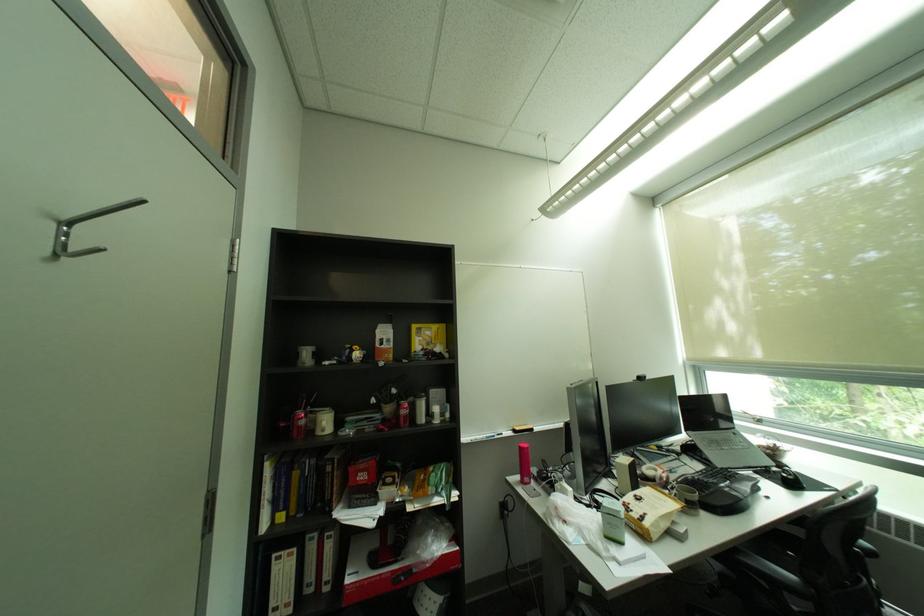
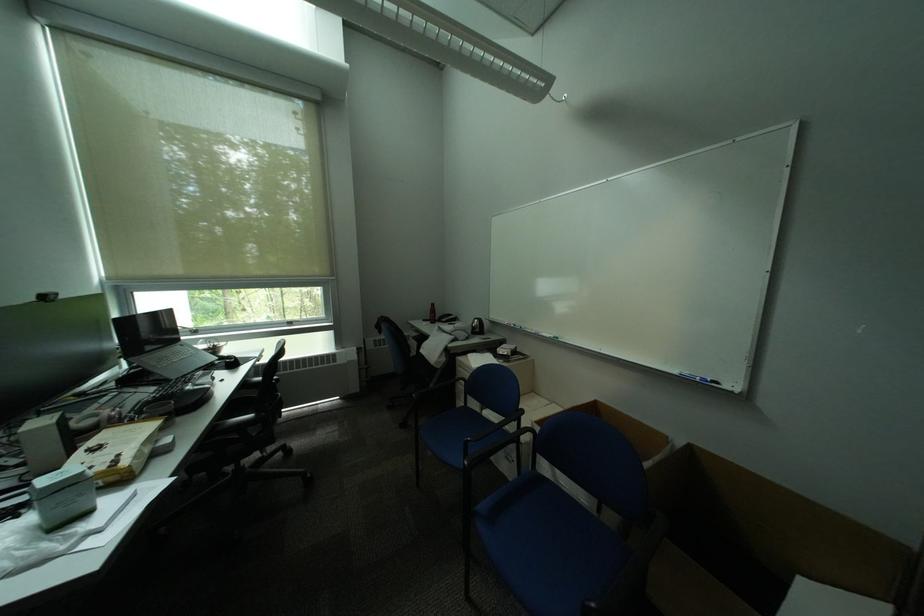
Question: The images are taken continuously from a first-person perspective. In which direction is your viewpoint rotating?

Choices:
 (A) Left
 (B) Right
 (C) Up
 (D) Down

Answer: (B)